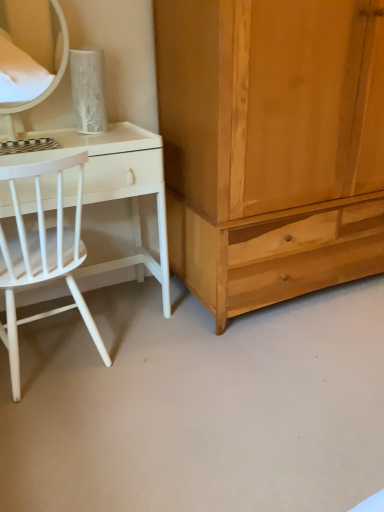
Question: In the image, is light brown wood cabinet at right positioned in front of or behind white matte wood chair at left?

Choices:
 (A) behind
 (B) front

Answer: (A)

Question: Does point coord(321,216) appear closer or farther from the camera than point coord(18,269)?

Choices:
 (A) farther
 (B) closer

Answer: (A)

Question: Which of these objects is positioned farthest from the light brown wood cabinet at right?

Choices:
 (A) white matte wood chair at left
 (B) matte white mirror at upper left
 (C) white glossy desk at left

Answer: (B)

Question: Estimate the real-world distances between objects in this image. Which object is farther from the white glossy desk at left?

Choices:
 (A) white matte wood chair at left
 (B) light brown wood cabinet at right
 (C) matte white mirror at upper left

Answer: (C)